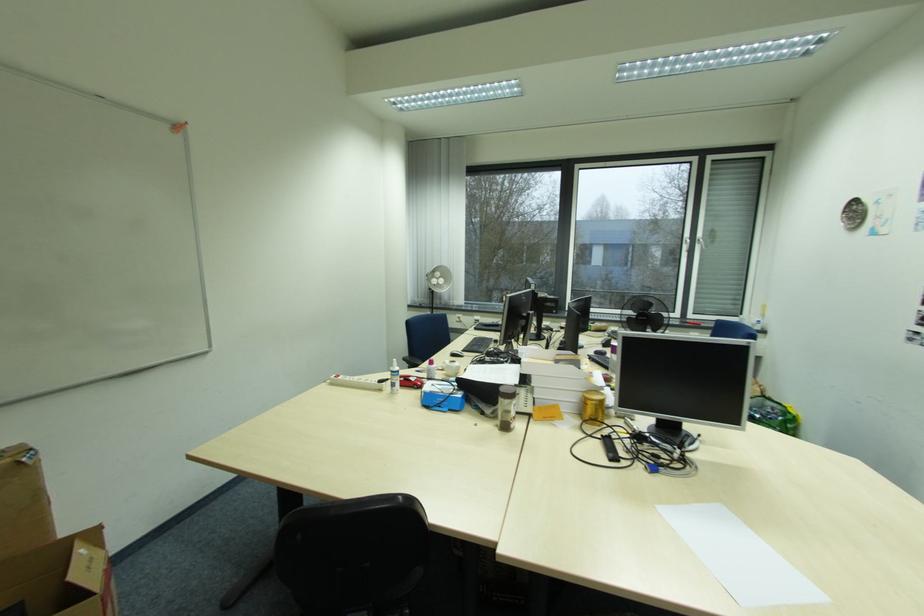
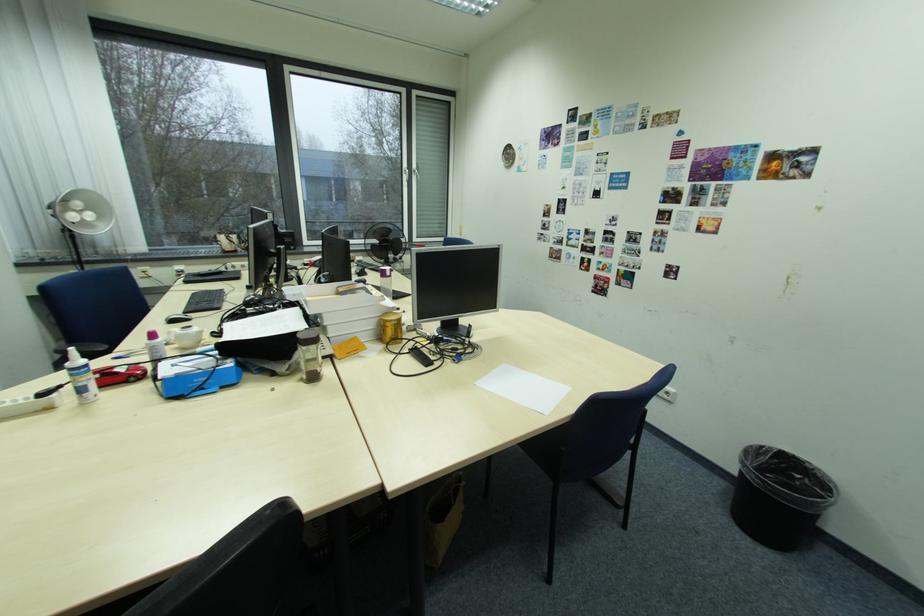
Question: How did the camera likely rotate?

Choices:
 (A) Left
 (B) Right
 (C) Up
 (D) Down

Answer: (B)